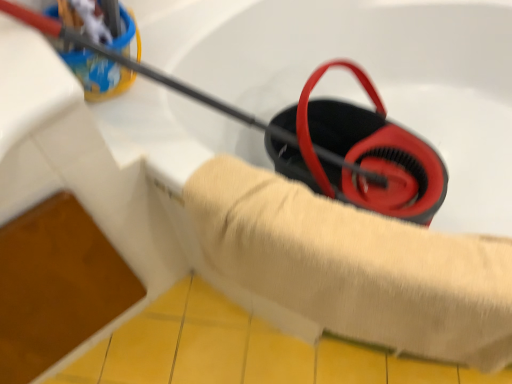
The image size is (512, 384). I want to click on beige cotton towel at center, so click(x=355, y=266).

The width and height of the screenshot is (512, 384). What do you see at coordinates (355, 266) in the screenshot?
I see `beige cotton towel at center` at bounding box center [355, 266].

Locate an element on the screen. The height and width of the screenshot is (384, 512). beige cotton towel at center is located at coordinates (355, 266).